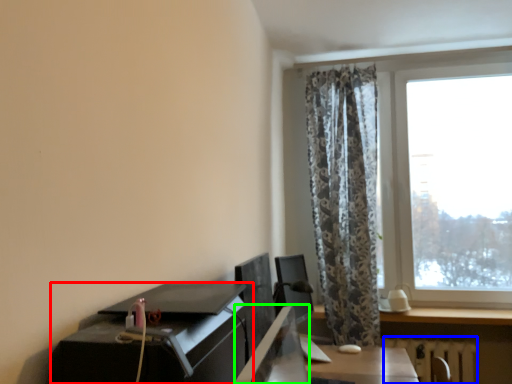
Question: Considering the real-world distances, which object is farthest from desk (highlighted by a red box)? radiator (highlighted by a blue box) or desktop (highlighted by a green box)?

Choices:
 (A) radiator
 (B) desktop

Answer: (A)